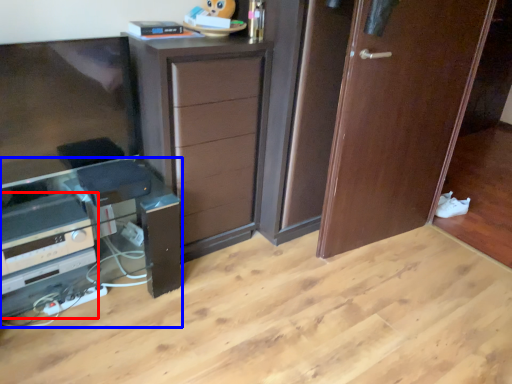
Question: Among these objects, which one is nearest to the camera, appliance (highlighted by a red box) or computer desk (highlighted by a blue box)?

Choices:
 (A) appliance
 (B) computer desk

Answer: (B)